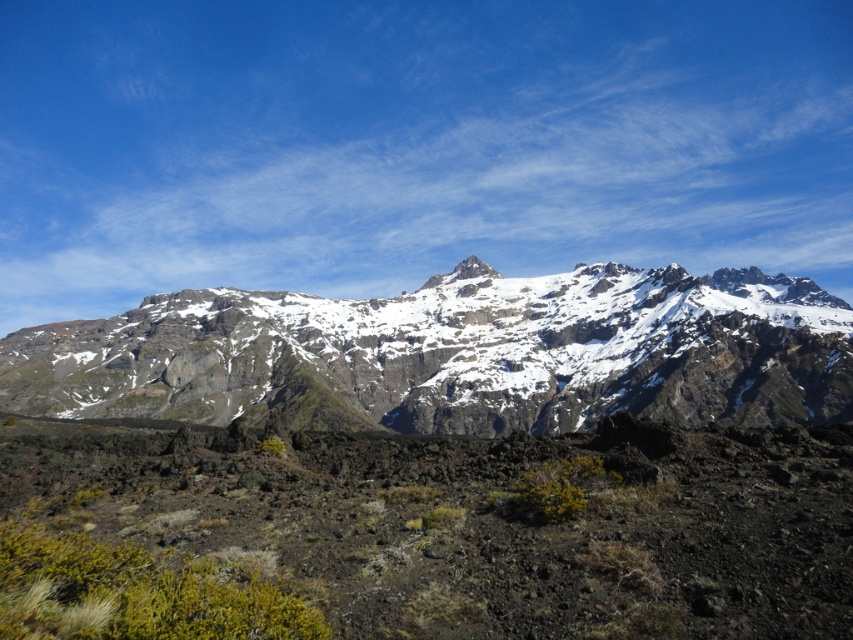
You are a hiker planning to climb both the snowy rocky mountain range at center and the white rocky peak at center. Which mountain should you start with if you want to tackle the one that is lower in elevation first?

The snowy rocky mountain range at center is positioned under the white rocky peak at center, which means the snowy rocky mountain range at center is lower in elevation. Therefore, you should start with the snowy rocky mountain range at center first.

You are a hiker planning to climb both the snowy rocky mountain range at center and the white rocky peak at center. Based on the scene description, which mountain has a higher elevation?

The snowy rocky mountain range at center has a greater height compared to the white rocky peak at center, so the snowy rocky mountain range at center has a higher elevation.

You are a hiker planning to take a photo of the snowy rocky mountain range at center and the white rocky peak at center. Which mountain should you focus on first if you want to capture both in one shot without changing your position?

You should focus on the snowy rocky mountain range at center first because it is closer to you than the white rocky peak at center, so keeping it in focus will ensure both are sharp in the photo.